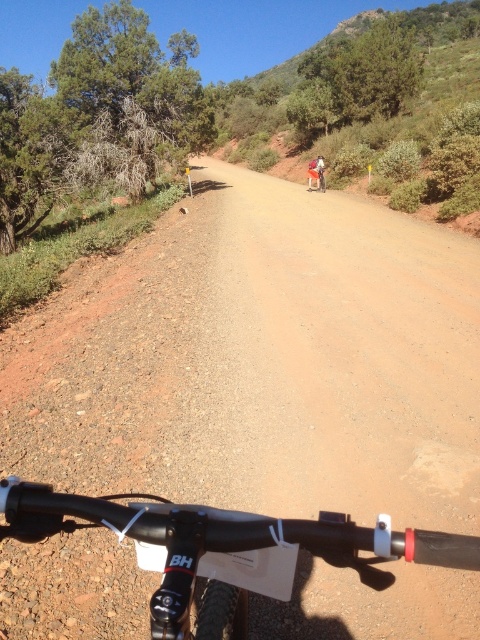
You are riding a mountain bike and need to check if your helmet is properly secured. The black matte bicycle handlebar at bottom is in your direct line of sight. If your helmet has a circumference of 22 inches, will it fit comfortably around your head without being too tight?

The black matte bicycle handlebar at bottom and viewer are 31.92 inches apart from each other. This distance is not directly related to helmet size. To determine if the helmet fits, ensure it is snug but comfortable, with no gaps larger than two fingers between the helmet and your head.

You are riding a mountain bike and looking at the trail ahead. There are two points marked on the trail at coordinates point (145, 524) and point (312, 179). Which point is closer to your current position?

Point (145, 524) is closer to the camera than point (312, 179), so the point closer to your current position is point (145, 524).